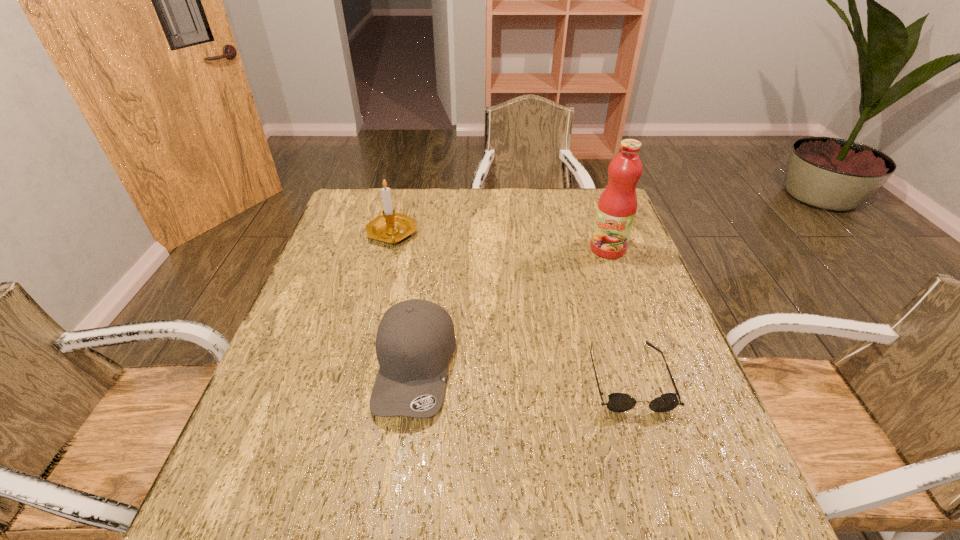
I want to click on the third tallest object, so click(415, 340).

Find the location of a particular element. sunglasses is located at coordinates (618, 402).

Where is `the tallest object`? the tallest object is located at coordinates (617, 205).

Identify the location of candle holder. This screenshot has height=540, width=960. (391, 227).

Find the location of a particular element. vacant space located 0.060m on the front brim of the second shortest object is located at coordinates (403, 455).

At what (x,y) coordinates should I click in order to perform the action: click on vacant area located 0.110m on the front-facing side of the sunglasses. Please return your answer as a coordinate pair (x, y). Looking at the image, I should click on (656, 468).

You are a GUI agent. You are given a task and a screenshot of the screen. Output one action in this format:
    pyautogui.click(x=<x>, y=<y>)
    Task: Click on the free space located 0.320m on the front label of the tallest object
    The height and width of the screenshot is (540, 960).
    Given the screenshot: What is the action you would take?
    pyautogui.click(x=562, y=331)

In order to click on free space located 0.140m on the front label of the tallest object in this screenshot , I will do `click(586, 287)`.

Where is `vacant space positioned on the front label of the tallest object`? This screenshot has width=960, height=540. vacant space positioned on the front label of the tallest object is located at coordinates (581, 296).

Locate an element on the screen. free space located 0.380m with a handle on the third shortest object is located at coordinates (482, 326).